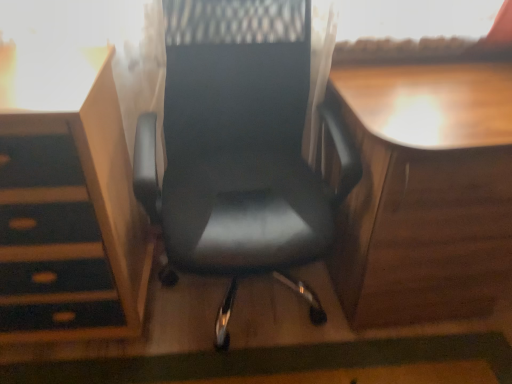
What do you see at coordinates (241, 139) in the screenshot? I see `black leather chair at center` at bounding box center [241, 139].

The image size is (512, 384). Find the location of `matte wood vanity at left`. matte wood vanity at left is located at coordinates (78, 195).

From a real-world perspective, which is physically above, matte wood vanity at left or wooden desk at right?

matte wood vanity at left is physically above.

Is point (30, 137) less distant than point (398, 247)?

That is True.

In the image, is matte wood vanity at left positioned in front of or behind wooden desk at right?

matte wood vanity at left is behind wooden desk at right.

Could you tell me if black leather chair at center is turned towards matte wood vanity at left?

No, black leather chair at center does not turn towards matte wood vanity at left.

Can you confirm if black leather chair at center is positioned to the right of matte wood vanity at left?

Yes.

Considering the positions of point (273, 187) and point (113, 276), is point (273, 187) closer or farther from the camera than point (113, 276)?

Clearly, point (273, 187) is more distant from the camera than point (113, 276).

Relative to matte wood vanity at left, is black leather chair at center in front or behind?

black leather chair at center is in front of matte wood vanity at left.

Is point (305, 100) closer to viewer compared to point (343, 231)?

That is True.

Considering the sizes of objects black leather chair at center and wooden desk at right in the image provided, who is thinner, black leather chair at center or wooden desk at right?

black leather chair at center is thinner.

How much distance is there between black leather chair at center and wooden desk at right?

black leather chair at center is 31.18 centimeters away from wooden desk at right.

Is the surface of black leather chair at center in direct contact with wooden desk at right?

No, black leather chair at center is not in contact with wooden desk at right.

Are wooden desk at right and black leather chair at center making contact?

wooden desk at right is not next to black leather chair at center, and they're not touching.

Can you tell me how much wooden desk at right and black leather chair at center differ in facing direction?

The facing directions of wooden desk at right and black leather chair at center are 0.631 degrees apart.

Is wooden desk at right positioned with its back to black leather chair at center?

That's not correct — wooden desk at right is not looking away from black leather chair at center.

Where is `chair above the wooden desk at right (from the image's perspective)`? chair above the wooden desk at right (from the image's perspective) is located at coordinates (241, 139).

Which of these two, wooden desk at right or matte wood vanity at left, is thinner?

matte wood vanity at left is thinner.

Is point (447, 84) in front of point (5, 65)?

That is False.

Looking at this image, is wooden desk at right smaller than matte wood vanity at left?

No.

The height and width of the screenshot is (384, 512). In order to click on chair above the matte wood vanity at left (from a real-world perspective) in this screenshot , I will do `click(241, 139)`.

From a real-world perspective, is matte wood vanity at left beneath black leather chair at center?

Correct, in the physical world, matte wood vanity at left is lower than black leather chair at center.

Is matte wood vanity at left oriented towards black leather chair at center?

No, matte wood vanity at left is not turned towards black leather chair at center.

Is matte wood vanity at left wider or thinner than black leather chair at center?

Considering their sizes, matte wood vanity at left looks slimmer than black leather chair at center.

In order to click on table on the right side of matte wood vanity at left in this screenshot , I will do `click(425, 192)`.

This screenshot has width=512, height=384. I want to click on chair above the matte wood vanity at left (from a real-world perspective), so click(241, 139).

Which object lies nearer to the anchor point wooden desk at right, matte wood vanity at left or black leather chair at center?

black leather chair at center is closer to wooden desk at right.

Which object lies further to the anchor point wooden desk at right, black leather chair at center or matte wood vanity at left?

matte wood vanity at left is further to wooden desk at right.

Estimate the real-world distances between objects in this image. Which object is further from black leather chair at center, matte wood vanity at left or wooden desk at right?

The object further to black leather chair at center is wooden desk at right.

Considering their positions, is wooden desk at right positioned closer to matte wood vanity at left than black leather chair at center?

black leather chair at center lies closer to matte wood vanity at left than the other object.

Based on their spatial positions, is black leather chair at center or wooden desk at right further from matte wood vanity at left?

wooden desk at right is positioned further to the anchor matte wood vanity at left.

From the image, which object appears to be farther from black leather chair at center, wooden desk at right or matte wood vanity at left?

Among the two, wooden desk at right is located further to black leather chair at center.

This screenshot has width=512, height=384. What are the coordinates of `chair situated between matte wood vanity at left and wooden desk at right from left to right` in the screenshot? It's located at (241, 139).